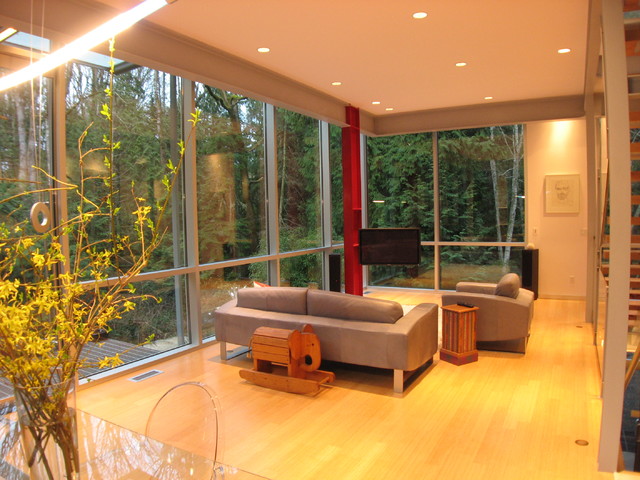
Identify the location of arm chair. (502, 314).